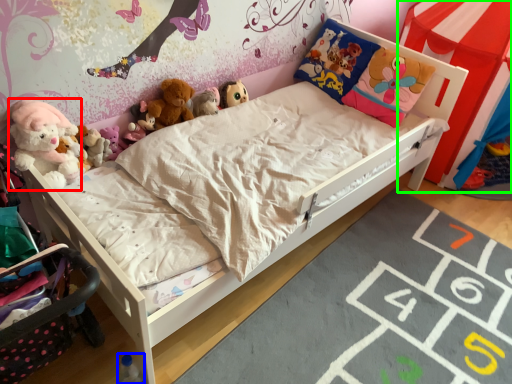
Question: Which object is the farthest from toy (highlighted by a red box)? Choose among these: toy (highlighted by a blue box) or canopy bed (highlighted by a green box).

Choices:
 (A) toy
 (B) canopy bed

Answer: (B)